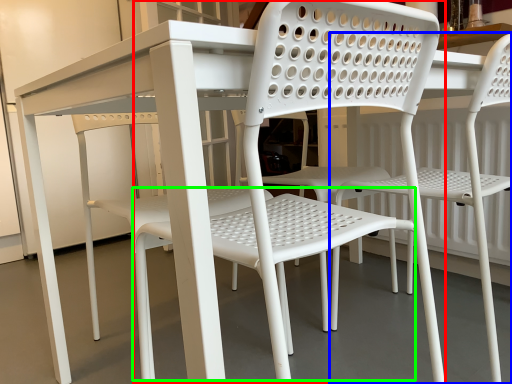
Question: Which is farther away from chair (highlighted by a red box)? chair (highlighted by a blue box) or bar stool (highlighted by a green box)?

Choices:
 (A) chair
 (B) bar stool

Answer: (A)